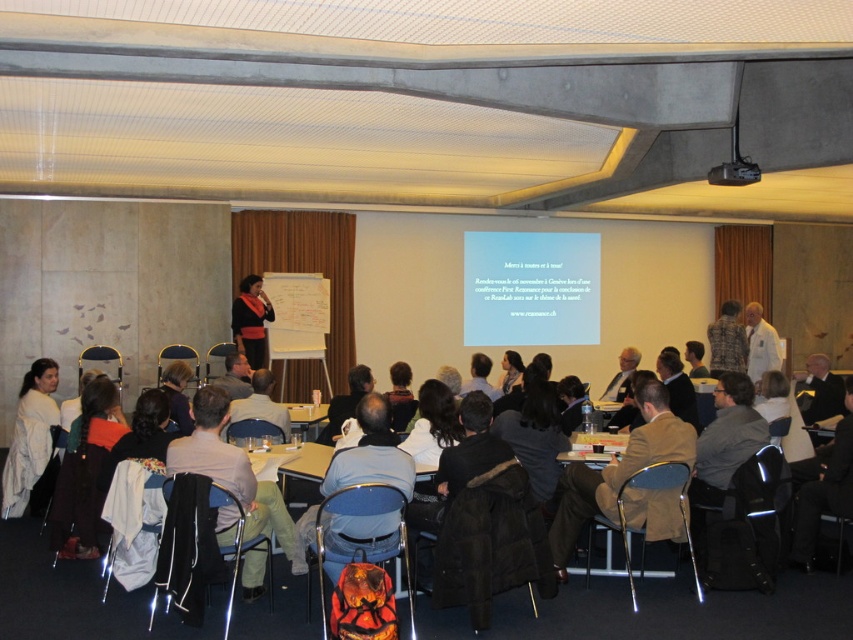
Is the position of matte black jacket at center more distant than that of white clothed person at right?

Yes, it is.

Is matte black jacket at center shorter than white clothed person at right?

In fact, matte black jacket at center may be taller than white clothed person at right.

This screenshot has width=853, height=640. Find the location of `matte black jacket at center`. matte black jacket at center is located at coordinates (251, 321).

Which is behind, point (560, 336) or point (370, 476)?

Point (560, 336)

Is blue matte projection screen at center behind blue fabric jacket at center?

Yes, it is.

Locate an element on the screen. The width and height of the screenshot is (853, 640). blue matte projection screen at center is located at coordinates (531, 289).

Between blue matte projection screen at center and brown leather jacket at lower center, which one has less height?

With less height is brown leather jacket at lower center.

Between point (570, 260) and point (587, 497), which one is positioned behind?

Positioned behind is point (570, 260).

The height and width of the screenshot is (640, 853). What are the coordinates of `blue matte projection screen at center` in the screenshot? It's located at (531, 289).